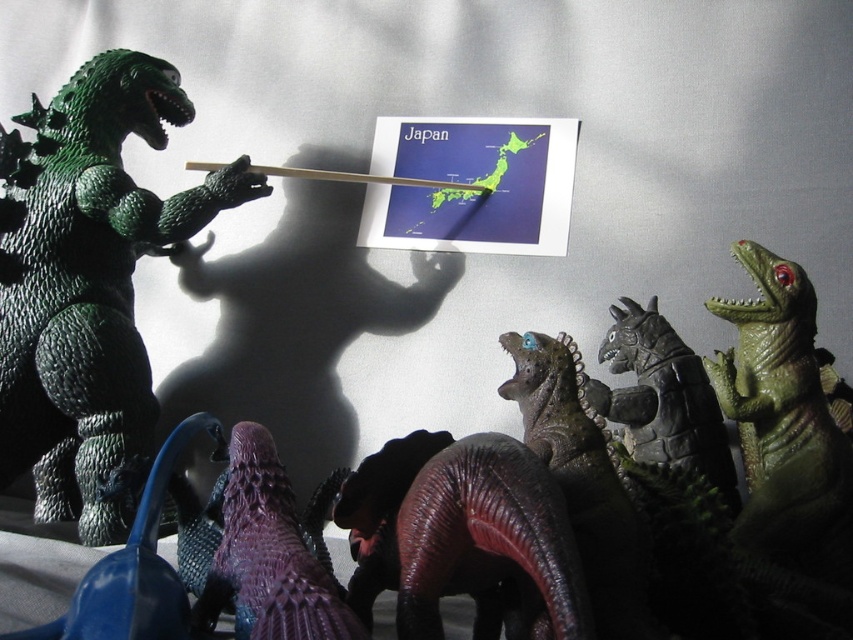
You are a child who wants to see the purple matte dinosaur at lower center clearly. Since the green rubbery dinosaur at left is blocking your view, what should you do?

Move the green rubbery dinosaur at left to the side so that you can see the purple matte dinosaur at lower center, which is currently behind it.

You are a child who wants to touch the green rubbery dinosaur at left. Can you reach it if your maximum arm length is 25 inches?

The green rubbery dinosaur at left is 30.40 inches from viewer, which is farther than your 25 inches arm length. You cannot reach it.